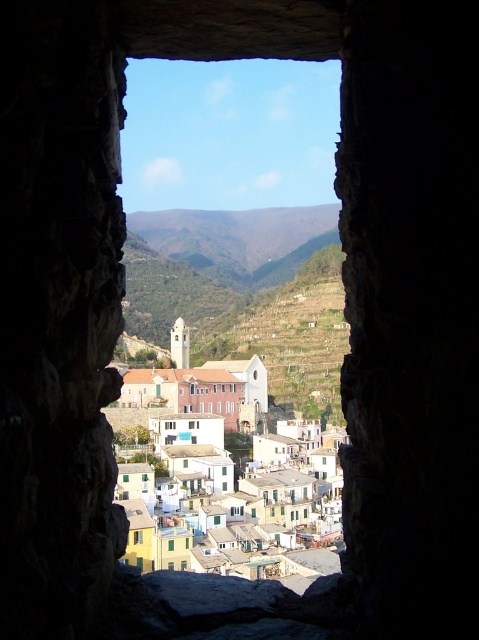
You are an architect designing a new addition to the village. You need to ensure that the new building does not block the view of the white matte building at center from the white matte window at center. Based on their current positions, is this possible?

The white matte window at center is positioned under the white matte building at center, so the building is already visible from the window. Therefore, it is possible to design the new addition without blocking the view as long as the new structure does not obstruct the line of sight between the two existing elements.

You are standing in front of the stone window frame and want to touch both points on the window frame. Which point should you reach for first, point (244, 289) or point (133, 532)?

You should reach for point (244, 289) first because it is closer to you than point (133, 532), which is further away.